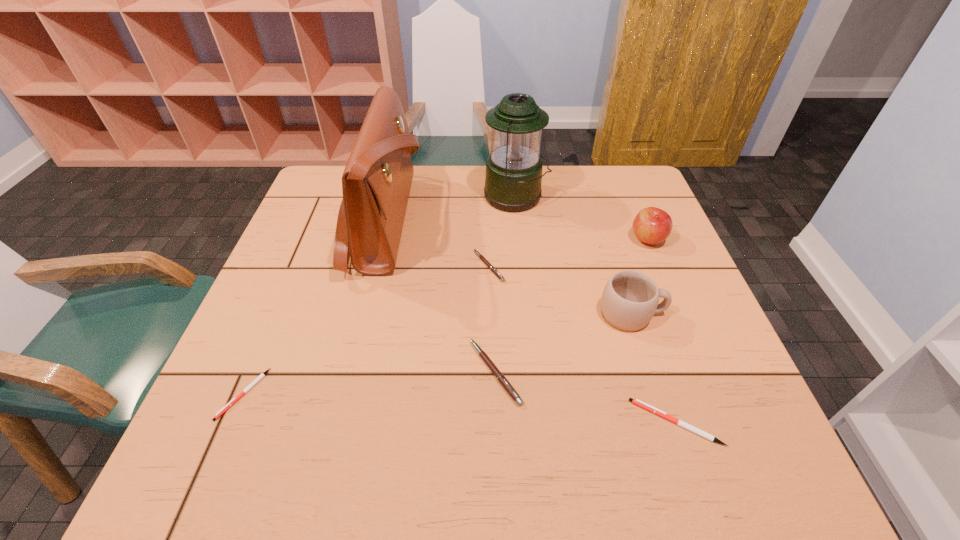
This screenshot has height=540, width=960. In the image, there is a desktop. What are the coordinates of `free region at the far left corner` in the screenshot? It's located at (319, 172).

This screenshot has height=540, width=960. In order to click on blank area at the near left corner in this screenshot , I will do `click(216, 484)`.

You are a GUI agent. You are given a task and a screenshot of the screen. Output one action in this format:
    pyautogui.click(x=<x>, y=<y>)
    Task: Click on the vacant space that's between the shortest pen and the bigger pink pen
    The width and height of the screenshot is (960, 540).
    Given the screenshot: What is the action you would take?
    pyautogui.click(x=370, y=383)

Locate an element on the screen. vacant region between the satchel and the mug is located at coordinates (508, 268).

Identify the location of free area in between the farthest pen and the rightmost pen. (583, 345).

Find the location of `empty location between the bigger pink pen and the apple`. empty location between the bigger pink pen and the apple is located at coordinates (571, 306).

Where is `empty space between the leftmost object and the smaller pink pen`? The image size is (960, 540). empty space between the leftmost object and the smaller pink pen is located at coordinates (367, 330).

The height and width of the screenshot is (540, 960). What are the coordinates of `free space between the smaller white pen and the brown satchel` in the screenshot? It's located at (314, 308).

You are a GUI agent. You are given a task and a screenshot of the screen. Output one action in this format:
    pyautogui.click(x=<x>, y=<y>)
    Task: Click on the free space between the tallest pen and the apple
    The image size is (960, 540).
    Given the screenshot: What is the action you would take?
    pyautogui.click(x=571, y=306)

Find the location of a particular element. empty space that is in between the rightmost pen and the green lantern is located at coordinates (595, 309).